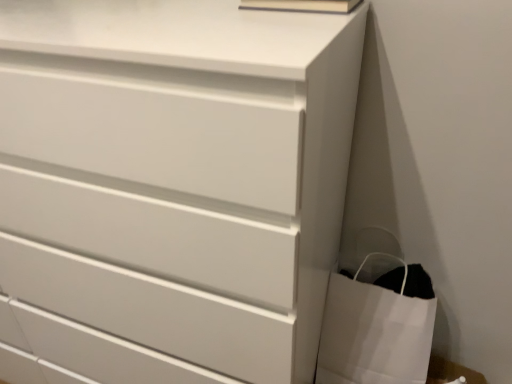
What is the approximate height of white matte chest of drawers at center?

The height of white matte chest of drawers at center is 1.12 meters.

At what (x,y) coordinates should I click in order to perform the action: click on white matte chest of drawers at center. Please return your answer as a coordinate pair (x, y). The height and width of the screenshot is (384, 512). Looking at the image, I should click on (170, 188).

In order to face white matte chest of drawers at center, should I rotate leftwards or rightwards?

To align with it, rotate left about 24.306°.

Describe the element at coordinates (170, 188) in the screenshot. I see `white matte chest of drawers at center` at that location.

Describe the element at coordinates (377, 326) in the screenshot. I see `white paper bag at lower right` at that location.

Locate an element on the screen. Image resolution: width=512 pixels, height=384 pixels. white paper bag at lower right is located at coordinates (377, 326).

The height and width of the screenshot is (384, 512). Identify the location of white matte chest of drawers at center. (170, 188).

Can you confirm if white matte chest of drawers at center is positioned to the left of white paper bag at lower right?

Yes, white matte chest of drawers at center is to the left of white paper bag at lower right.

Who is more distant, white matte chest of drawers at center or white paper bag at lower right?

white paper bag at lower right is more distant.

Does point (286, 147) come farther from viewer compared to point (337, 358)?

No, (286, 147) is closer to viewer.

From the image's perspective, would you say white matte chest of drawers at center is positioned over white paper bag at lower right?

Indeed, from the image's perspective, white matte chest of drawers at center is shown above white paper bag at lower right.

From a real-world perspective, is white matte chest of drawers at center physically located above or below white paper bag at lower right?

From a real-world perspective, white matte chest of drawers at center is physically above white paper bag at lower right.

Can you confirm if white matte chest of drawers at center is wider than white paper bag at lower right?

Yes.

Considering the relative sizes of white matte chest of drawers at center and white paper bag at lower right in the image provided, is white matte chest of drawers at center shorter than white paper bag at lower right?

In fact, white matte chest of drawers at center may be taller than white paper bag at lower right.

Between white matte chest of drawers at center and white paper bag at lower right, which one has larger size?

With larger size is white matte chest of drawers at center.

Is white matte chest of drawers at center situated inside white paper bag at lower right or outside?

white matte chest of drawers at center lies outside white paper bag at lower right.

Is white matte chest of drawers at center next to white paper bag at lower right?

No, white matte chest of drawers at center is not next to white paper bag at lower right.

Is white matte chest of drawers at center oriented towards white paper bag at lower right?

No, white matte chest of drawers at center does not turn towards white paper bag at lower right.

Can you tell me how much white matte chest of drawers at center and white paper bag at lower right differ in facing direction?

0.497 degrees.

What are the coordinates of `bag below the white matte chest of drawers at center (from the image's perspective)` in the screenshot? It's located at (377, 326).

Is white paper bag at lower right at the left side of white matte chest of drawers at center?

No, white paper bag at lower right is not to the left of white matte chest of drawers at center.

From the picture: Does white paper bag at lower right lie in front of white matte chest of drawers at center?

No, white paper bag at lower right is behind white matte chest of drawers at center.

Does point (385, 320) lie in front of point (8, 51)?

No, (385, 320) is behind (8, 51).

From the image's perspective, is white paper bag at lower right over white matte chest of drawers at center?

Incorrect, from the image's perspective, white paper bag at lower right is lower than white matte chest of drawers at center.

From a real-world perspective, is white paper bag at lower right physically located above or below white matte chest of drawers at center?

white paper bag at lower right is situated lower than white matte chest of drawers at center in the real world.

Which object is wider, white paper bag at lower right or white matte chest of drawers at center?

With larger width is white matte chest of drawers at center.

Between white paper bag at lower right and white matte chest of drawers at center, which one has more height?

With more height is white matte chest of drawers at center.

Between white paper bag at lower right and white matte chest of drawers at center, which one has larger size?

white matte chest of drawers at center.

Which is correct: white paper bag at lower right is inside white matte chest of drawers at center, or outside of it?

white paper bag at lower right is outside white matte chest of drawers at center.

Is white paper bag at lower right directly adjacent to white matte chest of drawers at center?

There is a gap between white paper bag at lower right and white matte chest of drawers at center.

Is white paper bag at lower right oriented away from white matte chest of drawers at center?

No, white paper bag at lower right's orientation is not away from white matte chest of drawers at center.

How different are the orientations of white paper bag at lower right and white matte chest of drawers at center in degrees?

0.497 degrees separate the facing orientations of white paper bag at lower right and white matte chest of drawers at center.

What are the coordinates of `the chest of drawers that is above the white paper bag at lower right (from a real-world perspective)` in the screenshot? It's located at (170, 188).

At what (x,y) coordinates should I click in order to perform the action: click on bag on the right of the white matte chest of drawers at center. Please return your answer as a coordinate pair (x, y). Looking at the image, I should click on (377, 326).

Where is `chest of drawers located on the left of white paper bag at lower right`? This screenshot has height=384, width=512. chest of drawers located on the left of white paper bag at lower right is located at coordinates (170, 188).